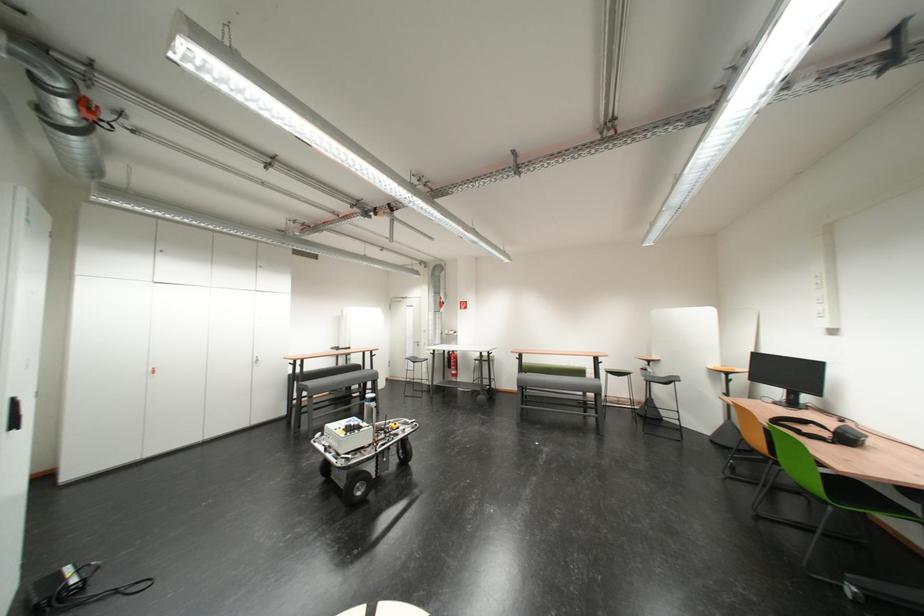
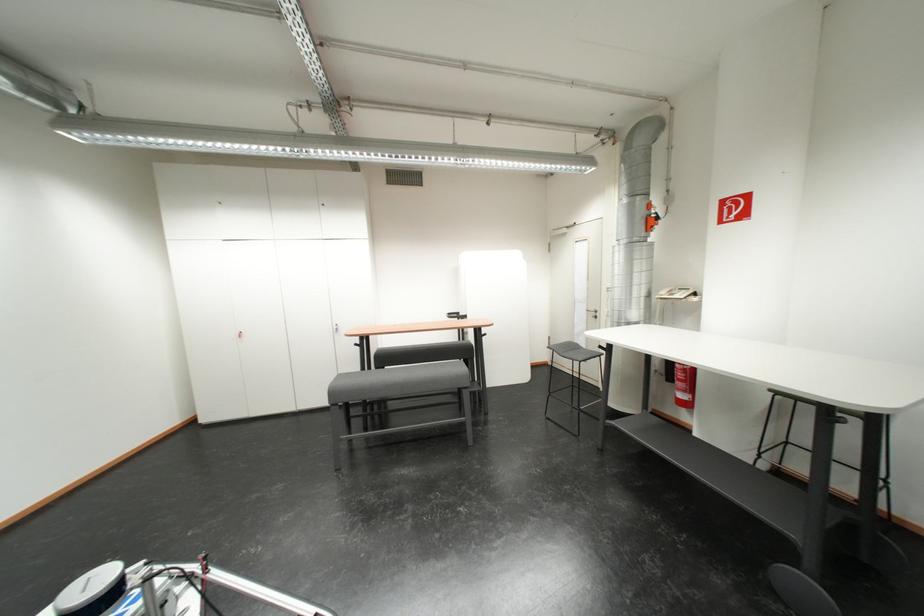
Find the pixel in the second image that matches point (450, 306) in the first image.

(654, 224)